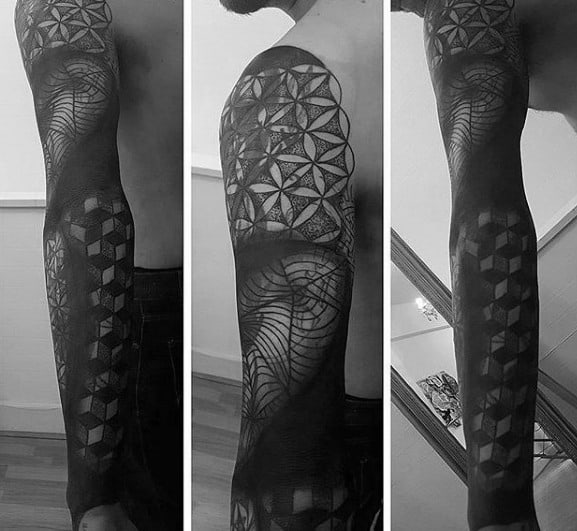
Where is `wall`? wall is located at coordinates (28, 306), (220, 291), (409, 441), (560, 324).